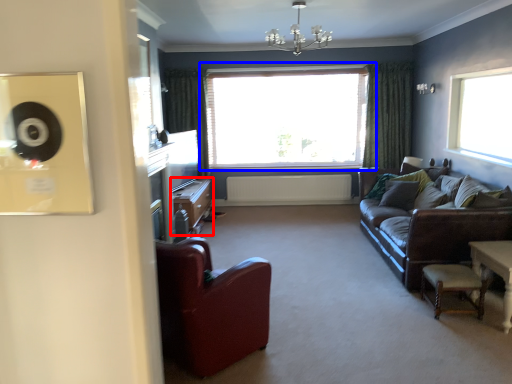
Question: Which of the following is the closest to the observer, cabinetry (highlighted by a red box) or window (highlighted by a blue box)?

Choices:
 (A) cabinetry
 (B) window

Answer: (A)